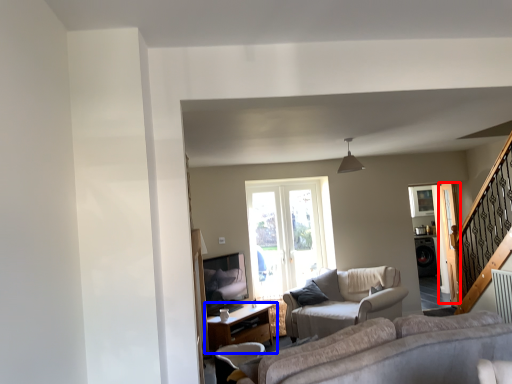
Question: Which of the following is the farthest to the observer, screen door (highlighted by a red box) or table (highlighted by a blue box)?

Choices:
 (A) screen door
 (B) table

Answer: (A)